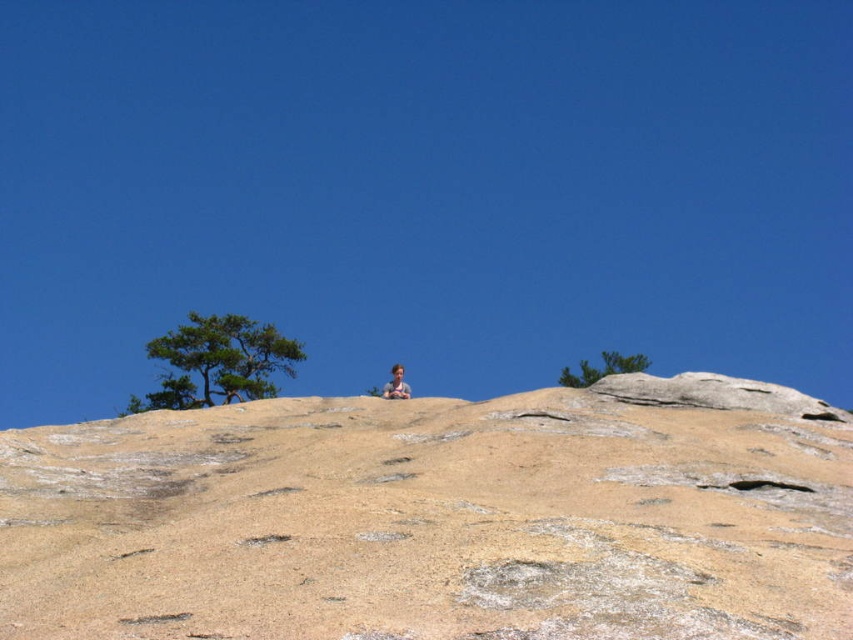
Does green leafy tree at upper left have a lesser width compared to green leafy tree at upper center?

In fact, green leafy tree at upper left might be wider than green leafy tree at upper center.

Is green leafy tree at upper left to the left of green leafy tree at upper center from the viewer's perspective?

Yes, green leafy tree at upper left is to the left of green leafy tree at upper center.

Is point (234, 371) closer to viewer compared to point (595, 376)?

No, it is not.

Where is `green leafy tree at upper left`? The height and width of the screenshot is (640, 853). green leafy tree at upper left is located at coordinates (218, 362).

Between green leafy tree at upper left and smooth tan skin at center, which one has less height?

smooth tan skin at center

Is green leafy tree at upper left positioned behind smooth tan skin at center?

Yes, green leafy tree at upper left is behind smooth tan skin at center.

Does point (195, 314) come closer to viewer compared to point (393, 392)?

No, it is not.

Where is `green leafy tree at upper left`? This screenshot has width=853, height=640. green leafy tree at upper left is located at coordinates (218, 362).

Between green leafy tree at upper center and smooth tan skin at center, which one is positioned lower?

Positioned lower is smooth tan skin at center.

Can you confirm if green leafy tree at upper center is positioned above smooth tan skin at center?

Yes.

Locate an element on the screen. Image resolution: width=853 pixels, height=640 pixels. green leafy tree at upper center is located at coordinates (602, 369).